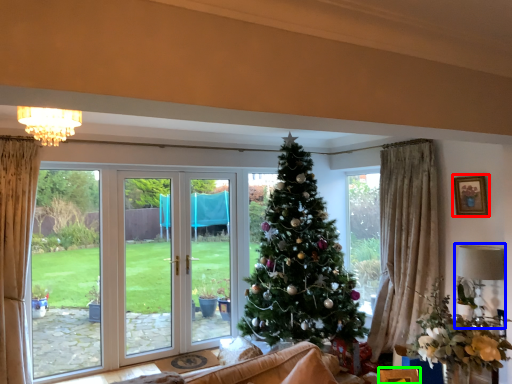
Question: Which object is the closest to the picture frame (highlighted by a red box)? Choose among these: lamp (highlighted by a blue box) or furniture (highlighted by a green box).

Choices:
 (A) lamp
 (B) furniture

Answer: (A)